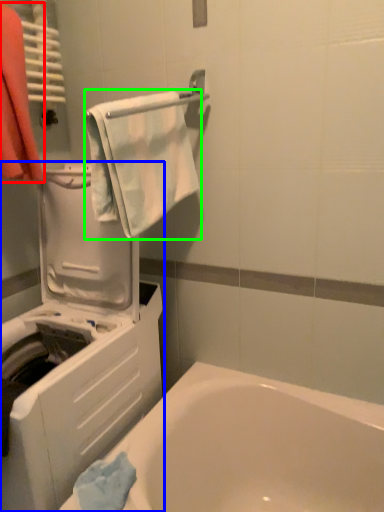
Question: Which object is positioned closest to laundry (highlighted by a red box)? Select from washing machine (highlighted by a blue box) and towel/napkin (highlighted by a green box).

Choices:
 (A) washing machine
 (B) towel/napkin

Answer: (B)